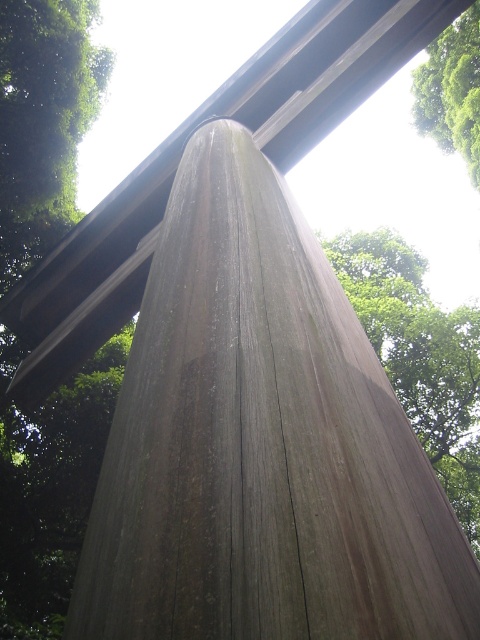
Does weathered wood pillar at center have a greater height compared to green leafy tree at upper right?

No.

How far apart are weathered wood pillar at center and green leafy tree at upper right?

weathered wood pillar at center and green leafy tree at upper right are 4.72 meters apart.

Between point (260, 406) and point (433, 56), which one is positioned behind?

The point (433, 56) is more distant.

Where is `weathered wood pillar at center`? This screenshot has height=640, width=480. weathered wood pillar at center is located at coordinates (261, 442).